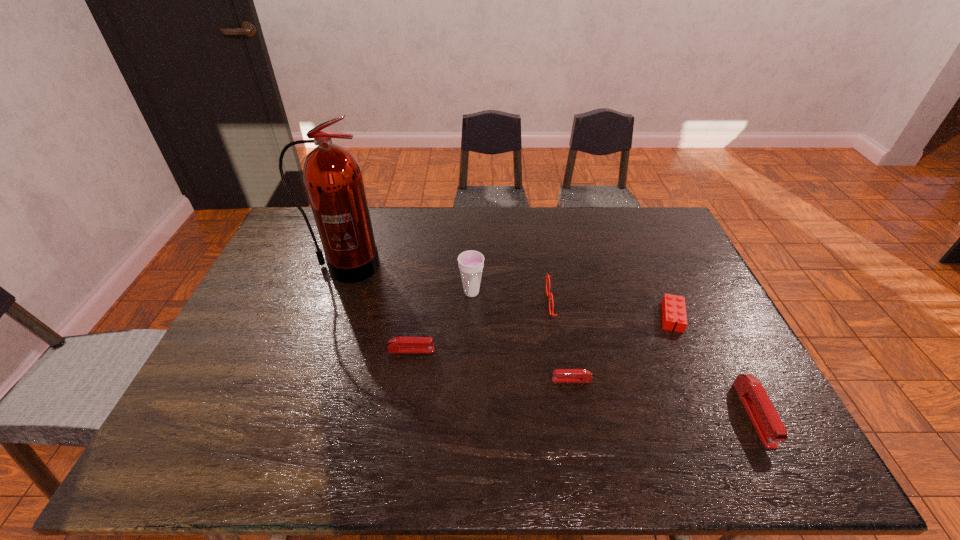
The image size is (960, 540). What are the coordinates of `unoccupied area between the second object from right to left and the farthest object` in the screenshot? It's located at (509, 292).

This screenshot has height=540, width=960. Find the location of `vacant area that lies between the rightmost stapler and the Lego`. vacant area that lies between the rightmost stapler and the Lego is located at coordinates (713, 365).

Identify which object is the fifth closest to the third object from left to right. Please provide its 2D coordinates. Your answer should be formatted as a tuple, i.e. [(x, y)], where the tuple contains the x and y coordinates of a point satisfying the conditions above.

[(673, 307)]

This screenshot has height=540, width=960. I want to click on object identified as the fourth closest to the shortest stapler, so click(x=471, y=263).

Locate an element on the screen. The image size is (960, 540). stapler that is the closest to the second stapler from right to left is located at coordinates (398, 344).

Select which stapler appears as the second closest to the cup. Please provide its 2D coordinates. Your answer should be formatted as a tuple, i.e. [(x, y)], where the tuple contains the x and y coordinates of a point satisfying the conditions above.

[(559, 375)]